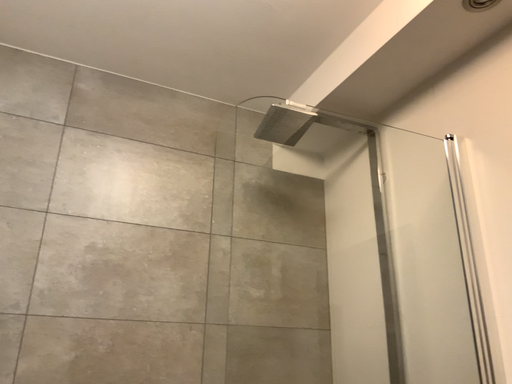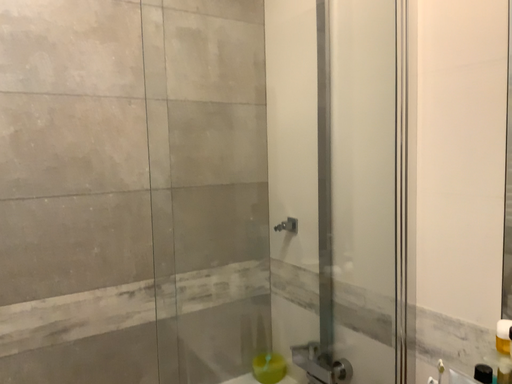
Question: How did the camera likely rotate when shooting the video?

Choices:
 (A) rotated left
 (B) rotated right

Answer: (B)